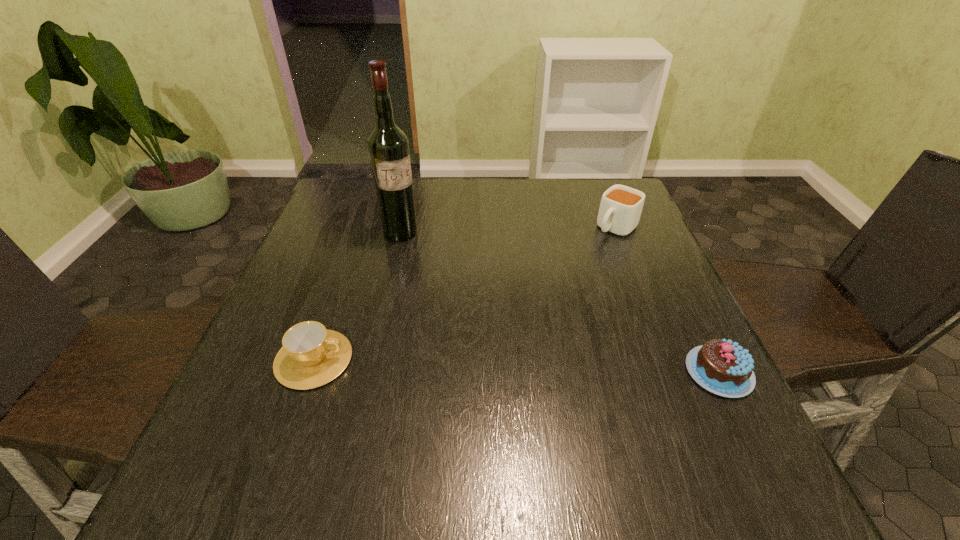
This screenshot has width=960, height=540. I want to click on free location located 0.370m on the front and back of the wine bottle, so click(486, 333).

Image resolution: width=960 pixels, height=540 pixels. In order to click on free point located 0.200m on the side with the handle of the second tallest object in this screenshot , I will do [x=564, y=279].

You are a GUI agent. You are given a task and a screenshot of the screen. Output one action in this format:
    pyautogui.click(x=<x>, y=<y>)
    Task: Click on the free space located on the side with the handle of the second tallest object
    
    Given the screenshot: What is the action you would take?
    [x=582, y=262]

At what (x,y) coordinates should I click in order to perform the action: click on free spot located on the side with the handle of the second tallest object. Please return your answer as a coordinate pair (x, y). Image resolution: width=960 pixels, height=540 pixels. Looking at the image, I should click on (530, 312).

The image size is (960, 540). I want to click on object located in the far edge section of the desktop, so [x=620, y=209].

At what (x,y) coordinates should I click in order to perform the action: click on object present at the near edge. Please return your answer as a coordinate pair (x, y). Looking at the image, I should click on (721, 366).

Find the location of a particular element. This screenshot has width=960, height=540. object located at the left edge is located at coordinates (311, 356).

The height and width of the screenshot is (540, 960). Find the location of `chocolate cake located at the right edge`. chocolate cake located at the right edge is located at coordinates (721, 366).

This screenshot has width=960, height=540. What are the coordinates of `cup that is at the right edge` in the screenshot? It's located at (620, 209).

Image resolution: width=960 pixels, height=540 pixels. Find the location of `object located in the far right corner section of the desktop`. object located in the far right corner section of the desktop is located at coordinates click(620, 209).